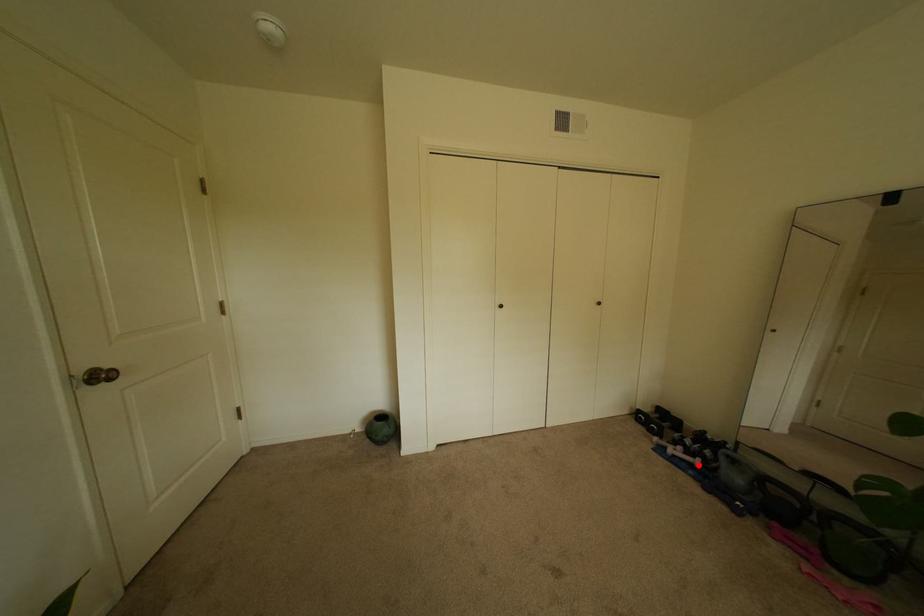
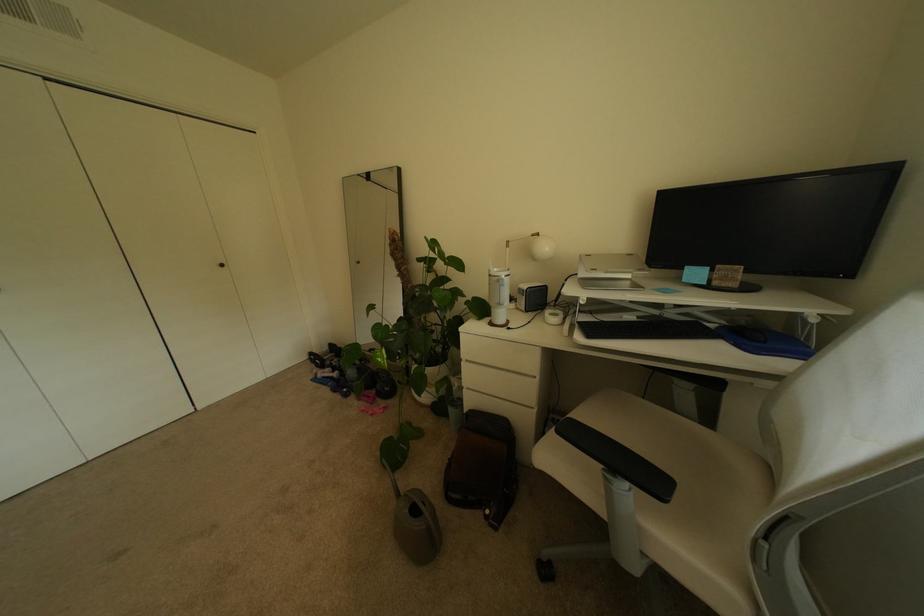
Locate, in the second image, the point that corresponds to the highlighted location in the first image.

(341, 379)